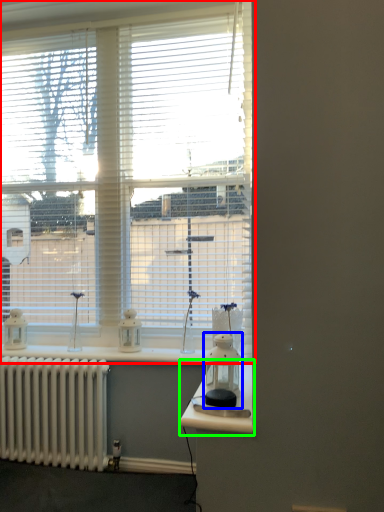
Question: Based on their relative distances, which object is farther from window (highlighted by a red box)? Choose from appliance (highlighted by a blue box) and table (highlighted by a green box).

Choices:
 (A) appliance
 (B) table

Answer: (B)